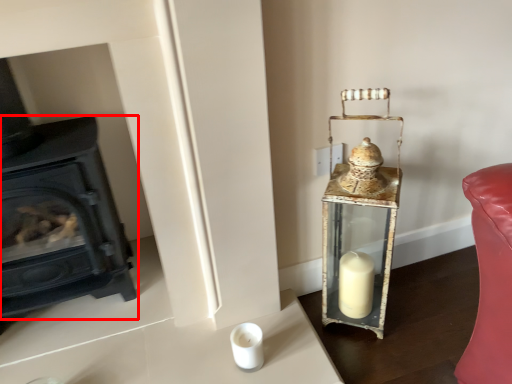
Question: Observing the image, what is the correct spatial positioning of wood burning stove (annotated by the red box) in reference to table lamp?

Choices:
 (A) right
 (B) left

Answer: (B)